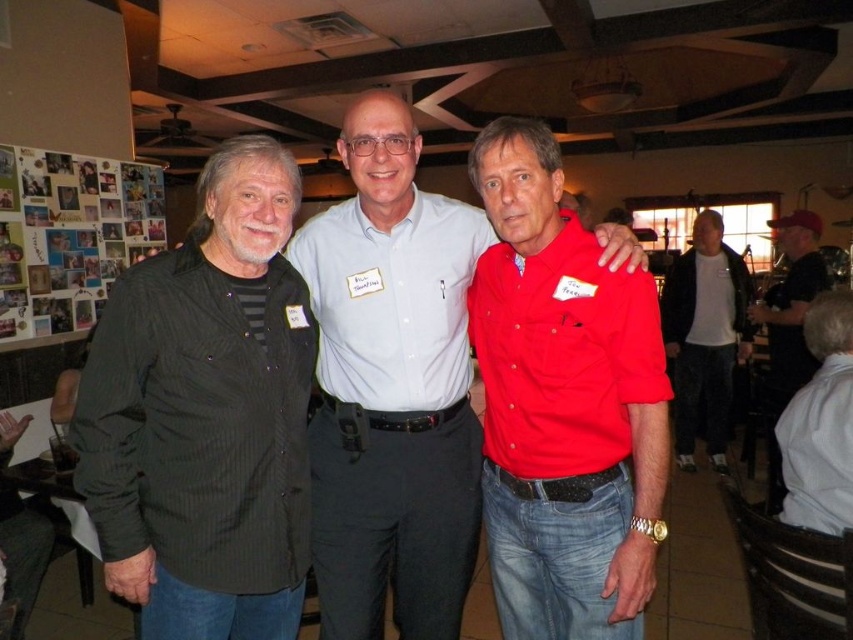
You are at a social event and need to identify the tallest object between the black textured shirt at center and the red fabric cap at right. Which one is taller?

The black textured shirt at center is taller than the red fabric cap at right.

Based on the photo, you are taking a photo of two points in the image. The first point is at position point [181,275] and the second is at point [374,332]. Which point is closer to the camera?

Point [181,275] is closer to the camera than point [374,332].

Please provide the coordinates of the black textured shirt at left in the image. The coordinate system has its origin at the bottom left corner of the image.

The coordinates of the black textured shirt at left are at point (x=206, y=413).